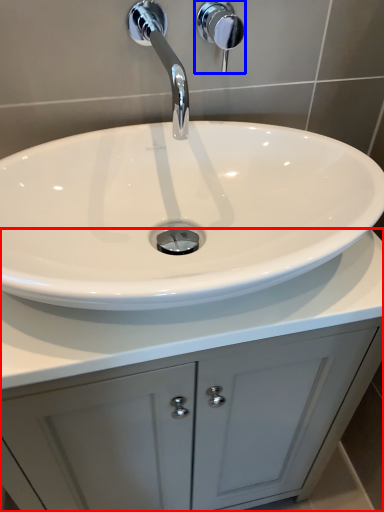
Question: Which of the following is the closest to the observer, bathroom cabinet (highlighted by a red box) or shower (highlighted by a blue box)?

Choices:
 (A) bathroom cabinet
 (B) shower

Answer: (A)